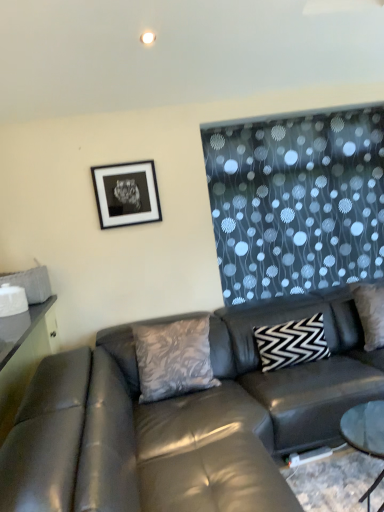
Question: Looking at the image, does leather couch at center seem bigger or smaller compared to matte black swivel chair at left?

Choices:
 (A) small
 (B) big

Answer: (B)

Question: Which is correct: leather couch at center is inside matte black swivel chair at left, or outside of it?

Choices:
 (A) inside
 (B) outside

Answer: (B)

Question: Which object is the farthest from the black matte picture frame at upper left?

Choices:
 (A) matte black swivel chair at left
 (B) silky gray pillow at center, which ranks as the first pillow in left-to-right order
 (C) black and white zigzag pillow at center, acting as the 2th pillow starting from the left
 (D) leather couch at center

Answer: (A)

Question: Considering the real-world distances, which object is closest to the black and white zigzag pillow at center, acting as the 2th pillow starting from the left?

Choices:
 (A) silky gray pillow at center, positioned as the 2th pillow in right-to-left order
 (B) matte black swivel chair at left
 (C) black matte picture frame at upper left
 (D) leather couch at center

Answer: (D)